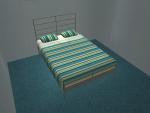
Where is `center of head of bed`? The height and width of the screenshot is (113, 150). center of head of bed is located at coordinates (55, 24).